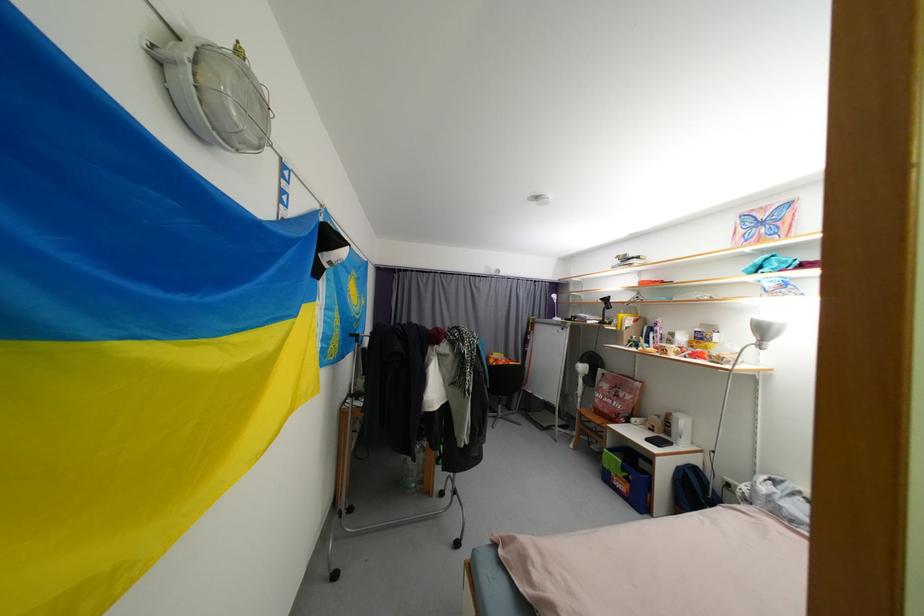
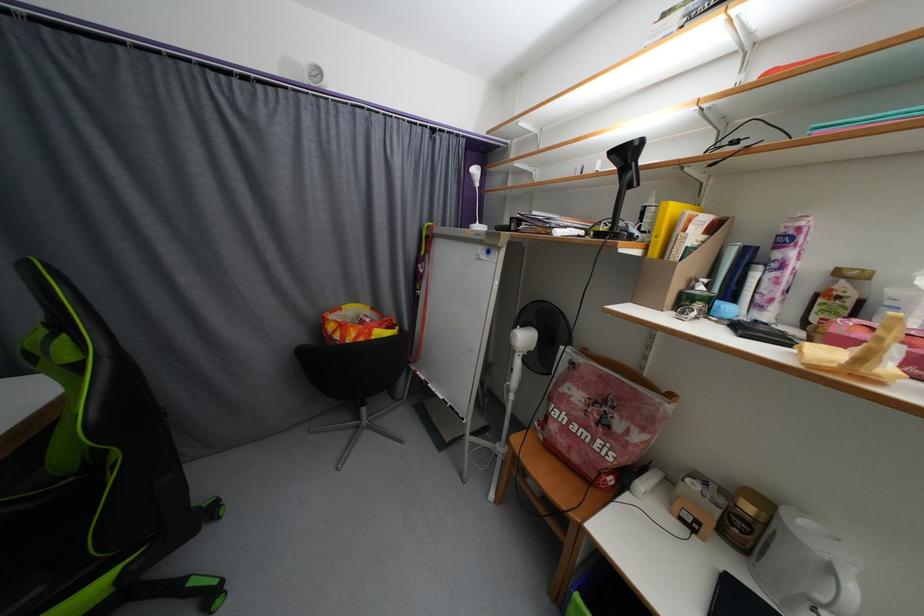
Looking at this image, which direction would the cameraman need to move to produce the second image?

The cameraman walked toward right, forward.